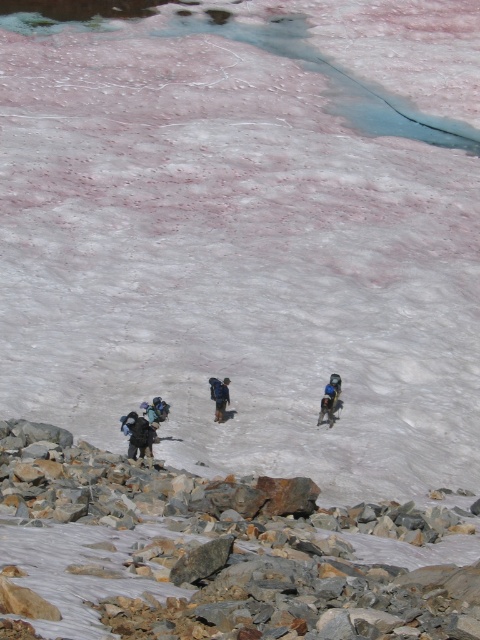
You are a hiker who just arrived at the scene and wants to locate your dark blue jacket at lower left. According to the coordinates provided, where should you look?

You should look at point (136, 435) to find the dark blue jacket at lower left.